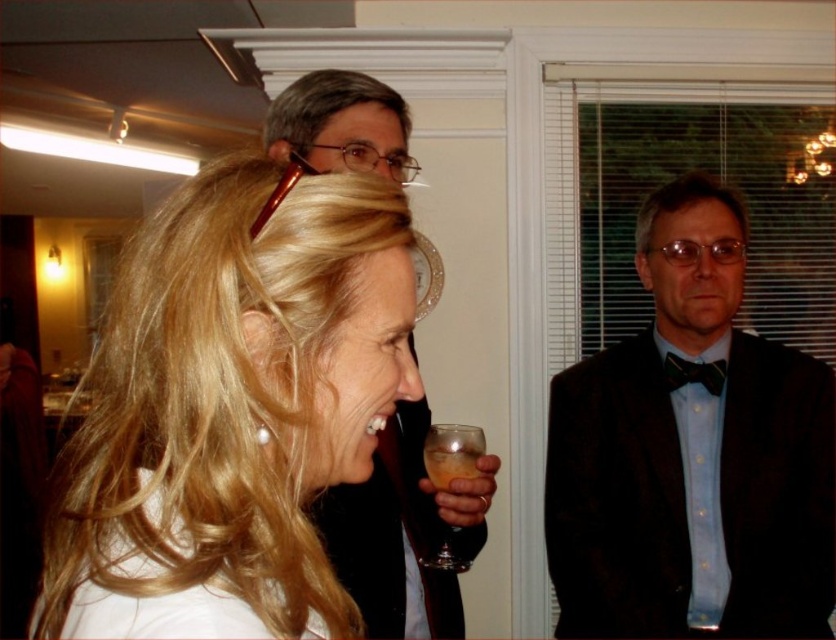
You are standing at the point labeled point (569,480) and want to walk to the point labeled point (444,531). Which direction should you move to get closer to your destination?

You should move backward because the point (444,531) is further away from the viewer compared to point (569,480).

You are a photographer adjusting your camera settings for a closeup shot of the dark blue satin bow tie at right. The camera is set to focus at 1.5 meters. Will the bow tie be in focus?

The dark blue satin bow tie at right is 1.56 meters from the camera. Since the camera is focused at 1.5 meters, the bow tie is slightly out of focus by 0.06 meters.